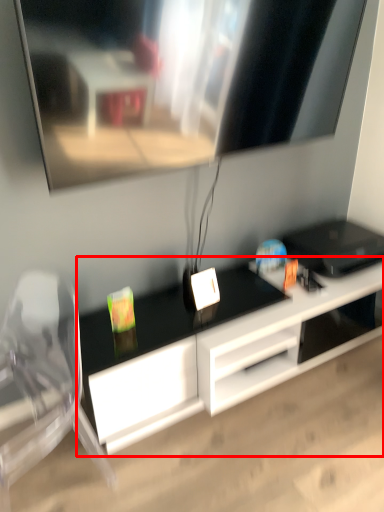
Question: Where is desk (annotated by the red box) located in relation to swivel chair in the image?

Choices:
 (A) left
 (B) right

Answer: (B)